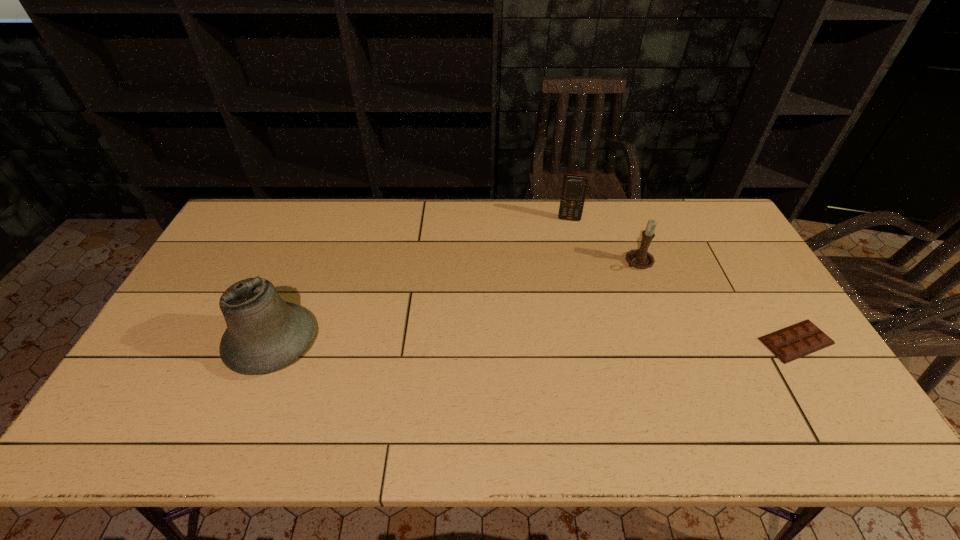
This screenshot has width=960, height=540. In order to click on free spot between the cellular telephone and the third object from left to right in this screenshot , I will do `click(604, 241)`.

Image resolution: width=960 pixels, height=540 pixels. Identify the location of free space between the third nearest object and the shortest object. tap(717, 302).

Find the location of a particular element. vacant region between the bell and the third object from right to left is located at coordinates (420, 281).

Locate an element on the screen. Image resolution: width=960 pixels, height=540 pixels. free spot between the candle holder and the cellular telephone is located at coordinates (604, 241).

At what (x,y) coordinates should I click in order to perform the action: click on empty location between the leftmost object and the farthest object. Please return your answer as a coordinate pair (x, y). Looking at the image, I should click on (420, 281).

Select which object appears as the third closest to the chocolate bar. Please provide its 2D coordinates. Your answer should be formatted as a tuple, i.e. [(x, y)], where the tuple contains the x and y coordinates of a point satisfying the conditions above.

[(264, 333)]

Point out which object is positioned as the nearest to the rightmost object. Please provide its 2D coordinates. Your answer should be formatted as a tuple, i.e. [(x, y)], where the tuple contains the x and y coordinates of a point satisfying the conditions above.

[(640, 258)]

Image resolution: width=960 pixels, height=540 pixels. What are the coordinates of `free point that satisfies the following two spatial constraints: 1. on the front side of the candle holder; 2. on the right side of the cellular telephone` in the screenshot? It's located at (579, 262).